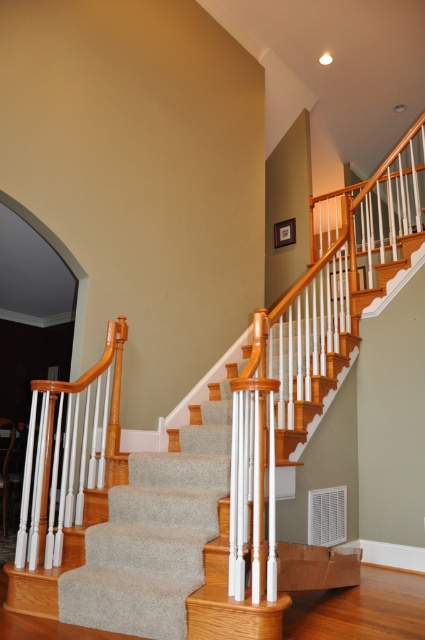
Question: Can you confirm if carpeted stairs at center is thinner than wooden handrail at center?

Choices:
 (A) yes
 (B) no

Answer: (B)

Question: Which of the following is the farthest from the observer?

Choices:
 (A) carpeted stairs at center
 (B) wooden handrail at center

Answer: (B)

Question: Which object is closer to the camera taking this photo?

Choices:
 (A) carpeted stairs at center
 (B) wooden handrail at center

Answer: (A)

Question: Considering the relative positions of carpeted stairs at center and wooden handrail at center in the image provided, where is carpeted stairs at center located with respect to wooden handrail at center?

Choices:
 (A) below
 (B) above

Answer: (A)

Question: Does carpeted stairs at center appear on the left side of wooden handrail at center?

Choices:
 (A) yes
 (B) no

Answer: (B)